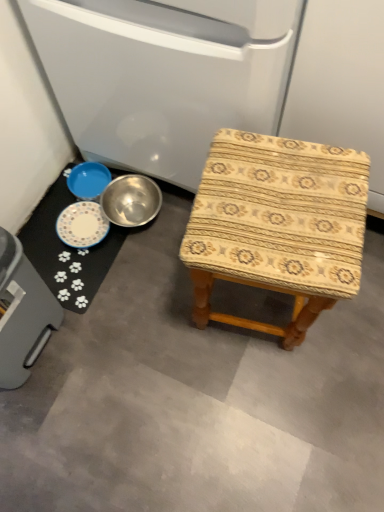
Identify the location of free space in front of gray plastic trash can at lower left, which ranks as the first appliance in bottom-to-top order. The image size is (384, 512). (49, 442).